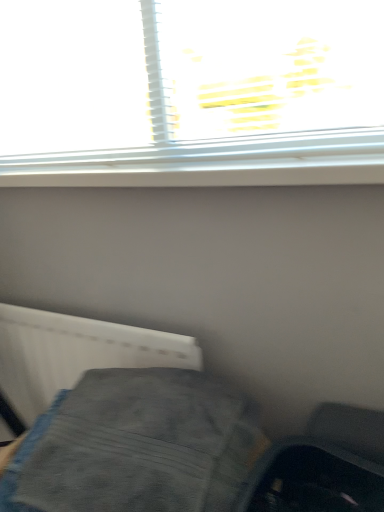
In order to click on gray fabric at lower left in this screenshot , I will do `click(176, 454)`.

What do you see at coordinates (176, 454) in the screenshot? The image size is (384, 512). I see `gray fabric at lower left` at bounding box center [176, 454].

At what (x,y) coordinates should I click in order to perform the action: click on white plastic radiator at lower left. Please return your answer as a coordinate pair (x, y). Looking at the image, I should click on (75, 353).

Describe the element at coordinates (75, 353) in the screenshot. I see `white plastic radiator at lower left` at that location.

You are a GUI agent. You are given a task and a screenshot of the screen. Output one action in this format:
    pyautogui.click(x=<x>, y=<y>)
    Task: Click on the gray fabric at lower left
    This screenshot has height=512, width=384.
    Given the screenshot: What is the action you would take?
    pyautogui.click(x=176, y=454)

Can you confirm if white plastic radiator at lower left is positioned to the right of gray fabric at lower left?

No.

Who is more distant, white plastic radiator at lower left or gray fabric at lower left?

white plastic radiator at lower left is further away from the camera.

Is point (63, 340) behind point (206, 401)?

That is True.

From the image's perspective, would you say white plastic radiator at lower left is positioned over gray fabric at lower left?

Indeed, from the image's perspective, white plastic radiator at lower left is shown above gray fabric at lower left.

Based on the photo, from a real-world perspective, is white plastic radiator at lower left positioned over gray fabric at lower left based on gravity?

Actually, white plastic radiator at lower left is physically below gray fabric at lower left in the real world.

Considering the sizes of objects white plastic radiator at lower left and gray fabric at lower left in the image provided, who is thinner, white plastic radiator at lower left or gray fabric at lower left?

white plastic radiator at lower left is thinner.

Between white plastic radiator at lower left and gray fabric at lower left, which one has less height?

Standing shorter between the two is gray fabric at lower left.

Can you confirm if white plastic radiator at lower left is bigger than gray fabric at lower left?

No.

Would you say white plastic radiator at lower left is outside gray fabric at lower left?

That's correct, white plastic radiator at lower left is outside of gray fabric at lower left.

Is the surface of white plastic radiator at lower left in direct contact with gray fabric at lower left?

white plastic radiator at lower left and gray fabric at lower left are not in contact.

Is white plastic radiator at lower left oriented towards gray fabric at lower left?

Yes.

Can you tell me how much white plastic radiator at lower left and gray fabric at lower left differ in facing direction?

9.09 degrees separate the facing orientations of white plastic radiator at lower left and gray fabric at lower left.

You are a GUI agent. You are given a task and a screenshot of the screen. Output one action in this format:
    pyautogui.click(x=<x>, y=<y>)
    Task: Click on the radiator located behind the gray fabric at lower left
    
    Given the screenshot: What is the action you would take?
    pyautogui.click(x=75, y=353)

Based on the photo, which is more to the left, gray fabric at lower left or white plastic radiator at lower left?

white plastic radiator at lower left is more to the left.

Considering their positions, is gray fabric at lower left located in front of or behind white plastic radiator at lower left?

gray fabric at lower left is in front of white plastic radiator at lower left.

Which is nearer, (120, 373) or (39, 378)?

Point (120, 373) is closer to the camera than point (39, 378).

From the image's perspective, is gray fabric at lower left above white plastic radiator at lower left?

Incorrect, from the image's perspective, gray fabric at lower left is lower than white plastic radiator at lower left.

From a real-world perspective, is gray fabric at lower left over white plastic radiator at lower left?

Yes, from a real-world perspective, gray fabric at lower left is above white plastic radiator at lower left.

Considering the sizes of objects gray fabric at lower left and white plastic radiator at lower left in the image provided, who is thinner, gray fabric at lower left or white plastic radiator at lower left?

With smaller width is white plastic radiator at lower left.

Who is shorter, gray fabric at lower left or white plastic radiator at lower left?

gray fabric at lower left.

Is gray fabric at lower left smaller than white plastic radiator at lower left?

No.

Is gray fabric at lower left inside the boundaries of white plastic radiator at lower left, or outside?

gray fabric at lower left is spatially situated outside white plastic radiator at lower left.

Would you consider gray fabric at lower left to be distant from white plastic radiator at lower left?

No, gray fabric at lower left is in close proximity to white plastic radiator at lower left.

Is gray fabric at lower left looking in the opposite direction of white plastic radiator at lower left?

Absolutely, gray fabric at lower left is directed away from white plastic radiator at lower left.

How different are the orientations of gray fabric at lower left and white plastic radiator at lower left in degrees?

9.09 degrees.

At what (x,y) coordinates should I click in order to perform the action: click on furniture on the right of white plastic radiator at lower left. Please return your answer as a coordinate pair (x, y). The height and width of the screenshot is (512, 384). Looking at the image, I should click on (176, 454).

Where is `radiator on the left side of gray fabric at lower left`? The height and width of the screenshot is (512, 384). radiator on the left side of gray fabric at lower left is located at coordinates (75, 353).

Image resolution: width=384 pixels, height=512 pixels. In the image, there is a gray fabric at lower left. Identify the location of radiator above it (from the image's perspective). (75, 353).